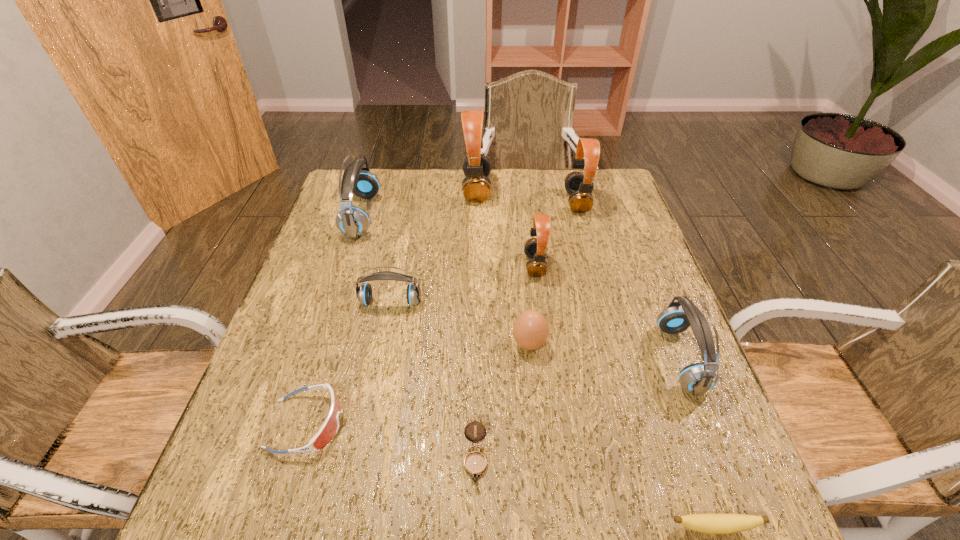
This screenshot has height=540, width=960. Find the location of `the biggest brown headset`. the biggest brown headset is located at coordinates (476, 186).

Identify the location of the tallest headset. This screenshot has width=960, height=540. (476, 186).

Where is `the fifth headset from left to right`? The image size is (960, 540). the fifth headset from left to right is located at coordinates (579, 186).

You are a GUI agent. You are given a task and a screenshot of the screen. Output one action in this format:
    pyautogui.click(x=<x>, y=<y>)
    Task: Click on the rightmost brown headset
    This screenshot has width=960, height=540.
    Given the screenshot: What is the action you would take?
    579,186

The height and width of the screenshot is (540, 960). Identify the location of the biggest blue headset. (352, 221).

The height and width of the screenshot is (540, 960). In order to click on the leftmost headset in this screenshot , I will do `click(352, 221)`.

This screenshot has height=540, width=960. I want to click on the fourth farthest object, so click(534, 248).

Find the location of a particular element. the fourth headset from left to right is located at coordinates (534, 248).

At what (x,y) coordinates should I click in order to perform the action: click on the second smallest blue headset. Please return your answer as a coordinate pair (x, y). This screenshot has height=540, width=960. Looking at the image, I should click on (698, 378).

Where is `the nearest blue headset`? The image size is (960, 540). the nearest blue headset is located at coordinates (698, 378).